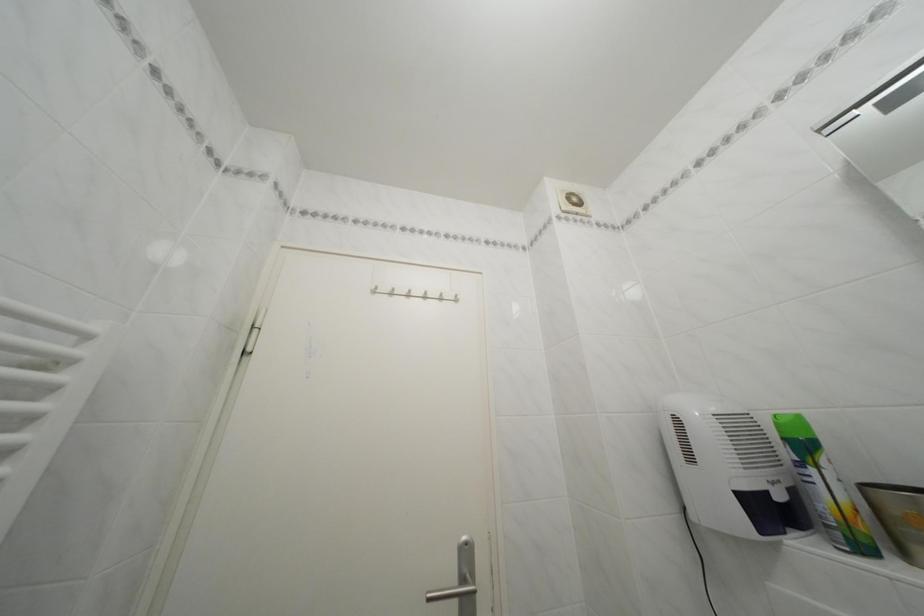
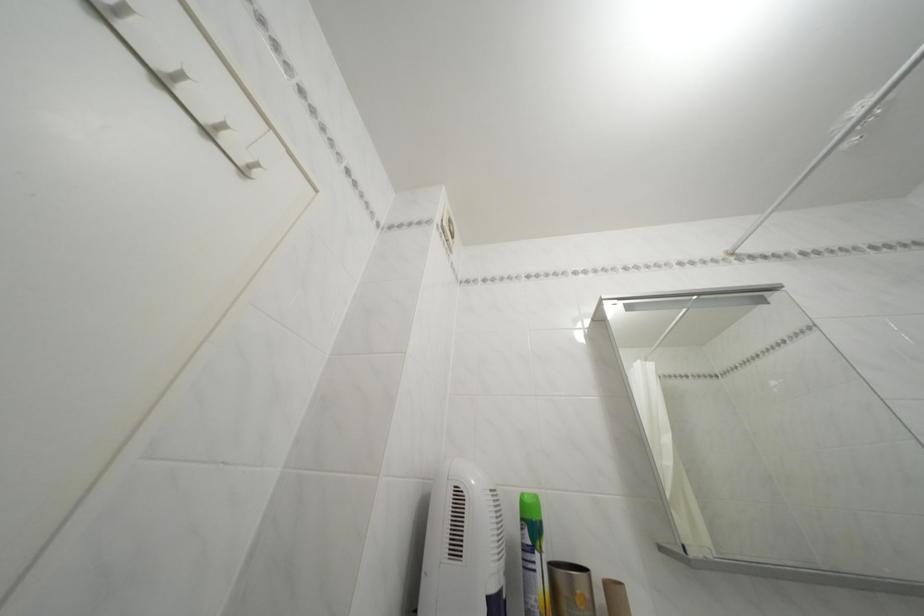
Locate, in the second image, the point that corresponds to (x=822, y=477) in the first image.

(545, 562)